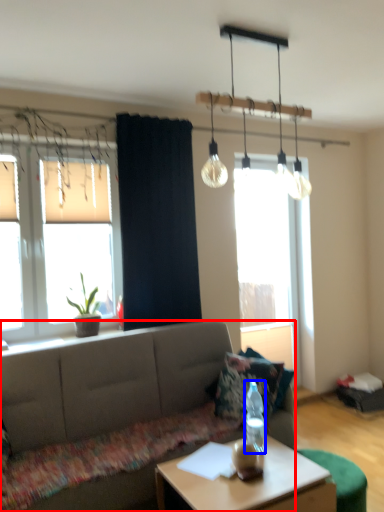
Question: Which point is further to the camera, studio couch (highlighted by a red box) or bottle (highlighted by a blue box)?

Choices:
 (A) studio couch
 (B) bottle

Answer: (B)